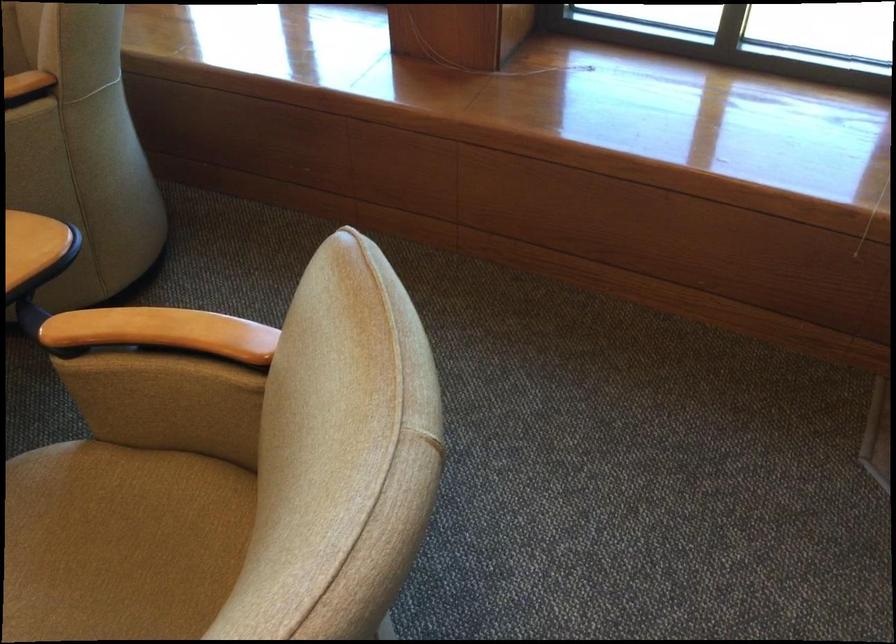
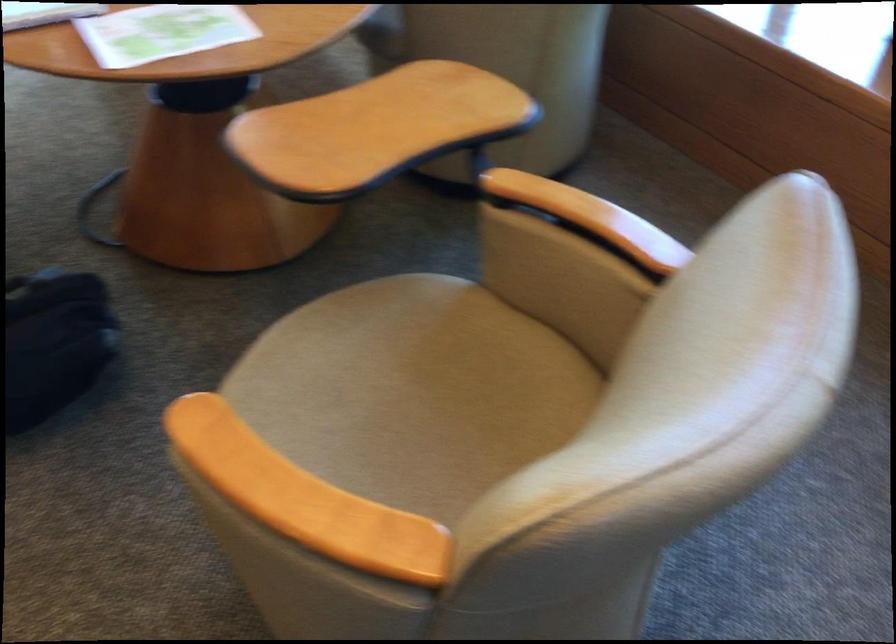
Question: The camera is either moving clockwise (left) or counter-clockwise (right) around the object. The first image is from the beginning of the video and the second image is from the end. Is the camera moving left or right when shooting the video?

Choices:
 (A) Left
 (B) Right

Answer: (B)